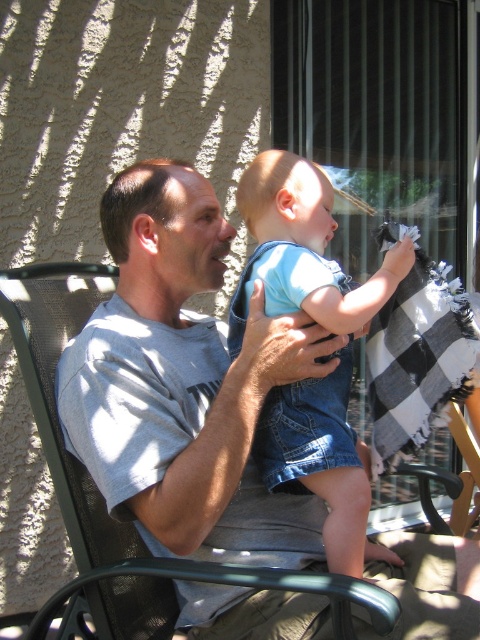
You are standing in the scene and want to move from the point at coordinates point (x=233, y=598) to the point at coordinates point (x=328, y=436). Which direction should you move to get closer to your destination?

To move from point (x=233, y=598) to point (x=328, y=436), you should move backward since point (x=233, y=598) is in front of point (x=328, y=436).